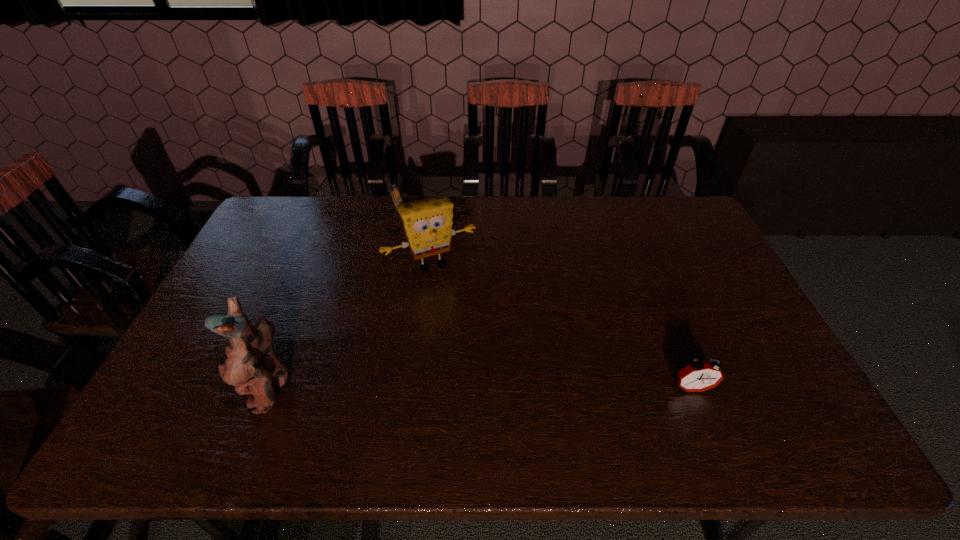
Identify the location of vacant area that lies between the farthest object and the tallest object. Image resolution: width=960 pixels, height=540 pixels. (335, 299).

The height and width of the screenshot is (540, 960). I want to click on blank region between the rightmost object and the sponge, so click(x=562, y=327).

This screenshot has height=540, width=960. I want to click on free spot between the rightmost object and the sponge, so click(562, 327).

At what (x,y) coordinates should I click in order to perform the action: click on vacant area between the sponge and the second shortest object. Please return your answer as a coordinate pair (x, y). Looking at the image, I should click on (562, 327).

Locate an element on the screen. The width and height of the screenshot is (960, 540). the closest object relative to the tallest object is located at coordinates (427, 223).

You are a GUI agent. You are given a task and a screenshot of the screen. Output one action in this format:
    pyautogui.click(x=<x>, y=<y>)
    Task: Click on the object identified as the closest to the rightmost object
    Image resolution: width=960 pixels, height=540 pixels.
    Given the screenshot: What is the action you would take?
    pyautogui.click(x=427, y=223)